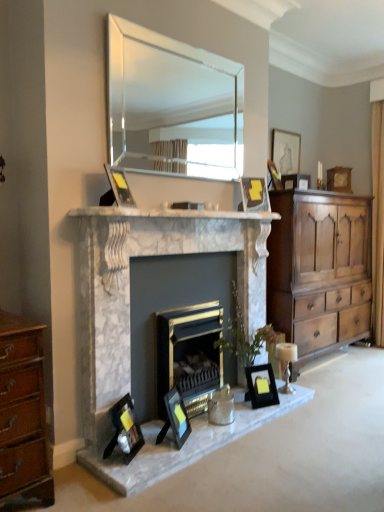
Question: Should I look upward or downward to see matte black picture frame at upper center, the eighth picture frame from the right?

Choices:
 (A) up
 (B) down

Answer: (A)

Question: Is wooden picture frame at upper right, marked as the eighth picture frame in a left-to-right arrangement, not within black matte picture frame at lower center, arranged as the sixth picture frame when viewed from the top?

Choices:
 (A) no
 (B) yes

Answer: (B)

Question: Is wooden picture frame at upper right, acting as the 1th picture frame starting from the back, positioned in front of black matte picture frame at lower center, arranged as the sixth picture frame when viewed from the top?

Choices:
 (A) yes
 (B) no

Answer: (B)

Question: Is there a large distance between wooden picture frame at upper right, acting as the first picture frame starting from the right, and black matte picture frame at lower center, the fifth picture frame when ordered from left to right?

Choices:
 (A) no
 (B) yes

Answer: (B)

Question: From a real-world perspective, is wooden picture frame at upper right, acting as the 1th picture frame starting from the back, positioned over black matte picture frame at lower center, placed as the third picture frame when sorted from bottom to top, based on gravity?

Choices:
 (A) no
 (B) yes

Answer: (B)

Question: Could you tell me if wooden picture frame at upper right, acting as the 7th picture frame starting from the bottom, is turned towards black matte picture frame at lower center, the fourth picture frame when ordered from front to back?

Choices:
 (A) no
 (B) yes

Answer: (A)

Question: Considering the relative sizes of wooden picture frame at upper right, which ranks as the second picture frame in top-to-bottom order, and black matte picture frame at lower center, arranged as the sixth picture frame when viewed from the top, in the image provided, is wooden picture frame at upper right, which ranks as the second picture frame in top-to-bottom order, wider than black matte picture frame at lower center, arranged as the sixth picture frame when viewed from the top,?

Choices:
 (A) no
 (B) yes

Answer: (B)

Question: From the image's perspective, is matte black picture frame at upper center, which is the third picture frame in back-to-front order, located beneath matte black picture frame at lower left, the 1th picture frame when ordered from bottom to top?

Choices:
 (A) no
 (B) yes

Answer: (A)

Question: Is matte black picture frame at upper center, arranged as the 6th picture frame when viewed from the front, not within matte black picture frame at lower left, acting as the second picture frame starting from the left?

Choices:
 (A) no
 (B) yes

Answer: (B)

Question: Is matte black picture frame at upper center, arranged as the 6th picture frame when viewed from the front, far from matte black picture frame at lower left, which is the eighth picture frame in back-to-front order?

Choices:
 (A) yes
 (B) no

Answer: (A)

Question: Does matte black picture frame at upper center, the sixth picture frame when ordered from bottom to top, have a lesser height compared to matte black picture frame at lower left, the 1th picture frame when ordered from bottom to top?

Choices:
 (A) yes
 (B) no

Answer: (A)

Question: Is matte black picture frame at upper center, arranged as the 3th picture frame when viewed from the right, smaller than matte black picture frame at lower left, acting as the second picture frame starting from the left?

Choices:
 (A) yes
 (B) no

Answer: (A)

Question: Is matte black picture frame at upper center, the sixth picture frame when ordered from bottom to top, next to matte black picture frame at lower left, acting as the second picture frame starting from the left, and touching it?

Choices:
 (A) no
 (B) yes

Answer: (A)

Question: Is matte black picture frame at upper center, arranged as the 6th picture frame when viewed from the front, outside of clear glass mirror at upper center?

Choices:
 (A) no
 (B) yes

Answer: (B)